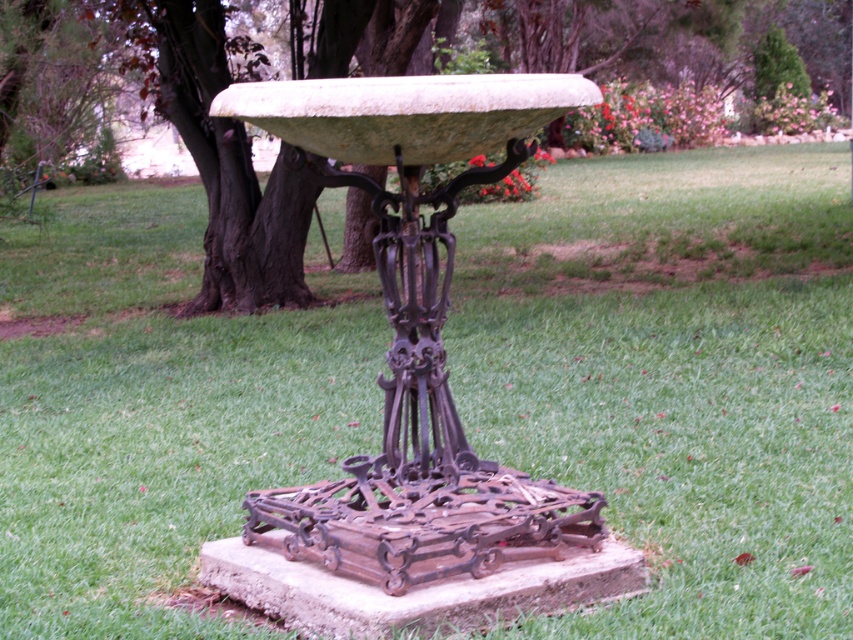
Question: Is green stone bowl at center to the left of green matte stone bowl at center from the viewer's perspective?

Choices:
 (A) no
 (B) yes

Answer: (B)

Question: Observing the image, what is the correct spatial positioning of green stone bowl at center in reference to green matte stone bowl at center?

Choices:
 (A) right
 (B) left

Answer: (B)

Question: Which of the following is the farthest from the observer?

Choices:
 (A) (666, 61)
 (B) (440, 262)

Answer: (A)

Question: Considering the relative positions of green stone bowl at center and green matte stone bowl at center in the image provided, where is green stone bowl at center located with respect to green matte stone bowl at center?

Choices:
 (A) above
 (B) below

Answer: (B)

Question: Which object is farther from the camera taking this photo?

Choices:
 (A) green matte stone bowl at center
 (B) green stone bowl at center

Answer: (A)

Question: Which of the following is the closest to the observer?

Choices:
 (A) coord(347,472)
 (B) coord(792,19)

Answer: (A)